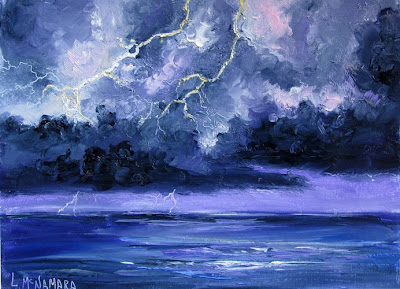
This screenshot has height=289, width=400. In order to click on lighting in this screenshot , I will do `click(215, 69)`.